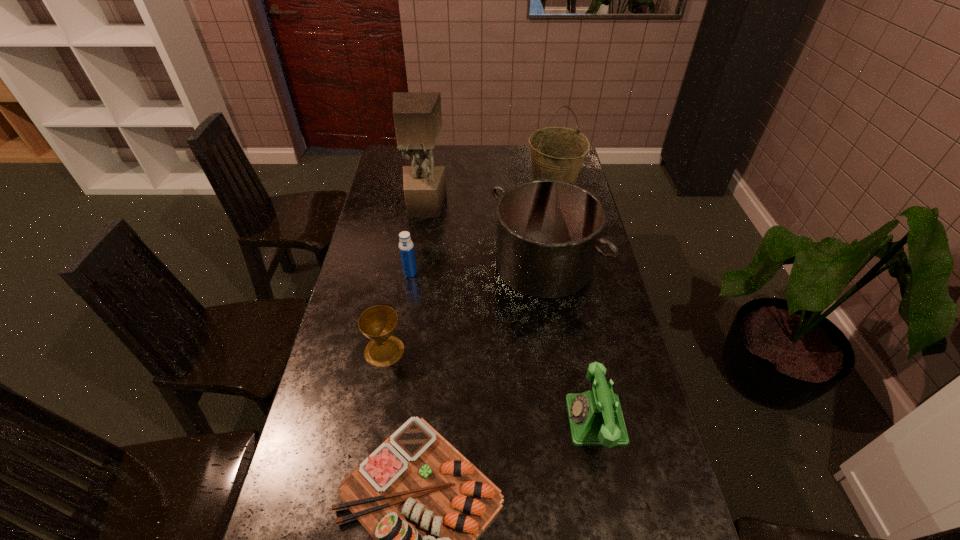
The image size is (960, 540). In order to click on object that is positioned at the far right corner in this screenshot , I will do `click(557, 153)`.

This screenshot has width=960, height=540. What are the coordinates of `free spot at the far edge of the desktop` in the screenshot? It's located at pyautogui.click(x=448, y=148).

This screenshot has width=960, height=540. In order to click on vacant area at the left edge in this screenshot , I will do `click(353, 428)`.

Identify the location of free area in between the third nearest object and the tallest object. The image size is (960, 540). (404, 278).

This screenshot has height=540, width=960. Find the location of `free space between the telephone and the sculpture`. free space between the telephone and the sculpture is located at coordinates (510, 313).

This screenshot has height=540, width=960. Identify the location of vacant area that lies between the chalice and the pan. (464, 308).

At what (x,y) coordinates should I click in order to perform the action: click on empty location between the pan and the telephone. Please return your answer as a coordinate pair (x, y). The width and height of the screenshot is (960, 540). Looking at the image, I should click on (569, 342).

You are a GUI agent. You are given a task and a screenshot of the screen. Output one action in this format:
    pyautogui.click(x=<x>, y=<y>)
    Task: Click on the vacant area that lies between the tallest object and the pan
    
    Given the screenshot: What is the action you would take?
    pyautogui.click(x=484, y=235)

Identify the location of the fourth closest object to the shortest object. This screenshot has width=960, height=540. (406, 248).

Find the location of a particular element. Image resolution: width=960 pixels, height=540 pixels. object that is the fourth closest to the chalice is located at coordinates (595, 416).